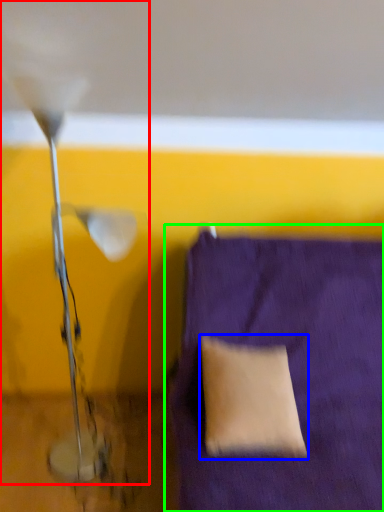
Question: Considering the real-world distances, which object is closest to lamp (highlighted by a red box)? pillow (highlighted by a blue box) or furniture (highlighted by a green box).

Choices:
 (A) pillow
 (B) furniture

Answer: (A)